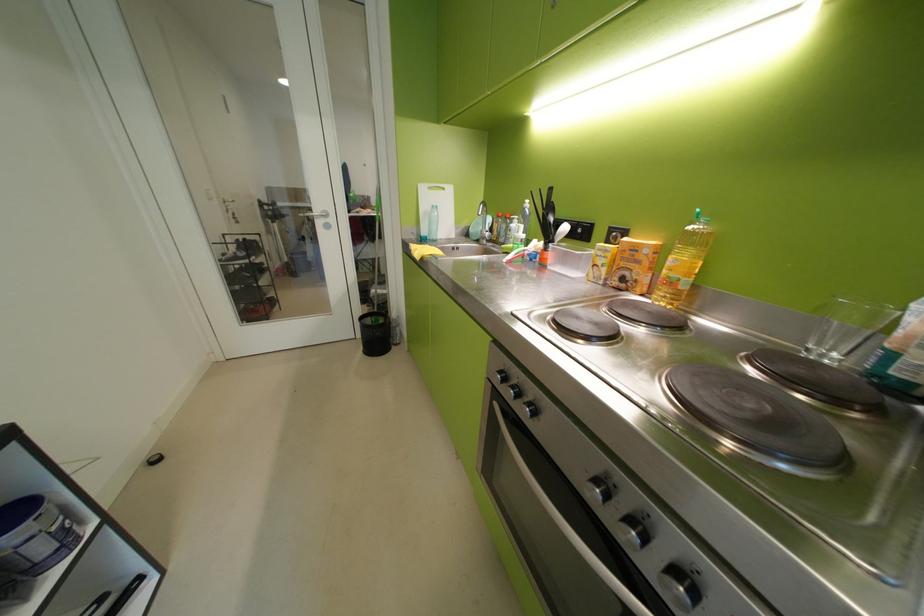
Where would you lift the white cutting board? Please return your answer as a coordinate pair (x, y).

(436, 208)